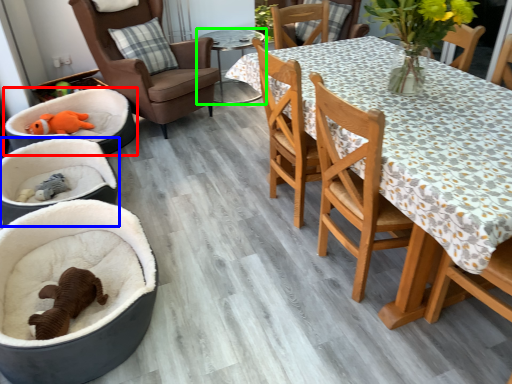
Question: Estimate the real-world distances between objects in this image. Which object is closer to infant bed (highlighted by a red box), baby carriage (highlighted by a blue box) or table (highlighted by a green box)?

Choices:
 (A) baby carriage
 (B) table

Answer: (A)